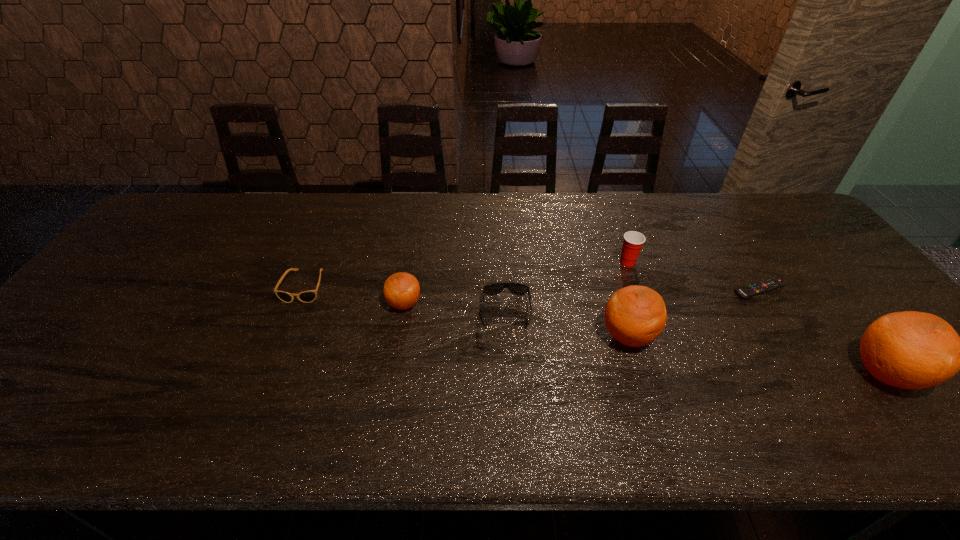
Observe the arrangement of all oranges in the image. To keep them evenly spaced, where would you place another orange on the left? Please locate a free space. Please provide its 2D coordinates. Your answer should be formatted as a tuple, i.e. [(x, y)], where the tuple contains the x and y coordinates of a point satisfying the conditions above.

[(209, 276)]